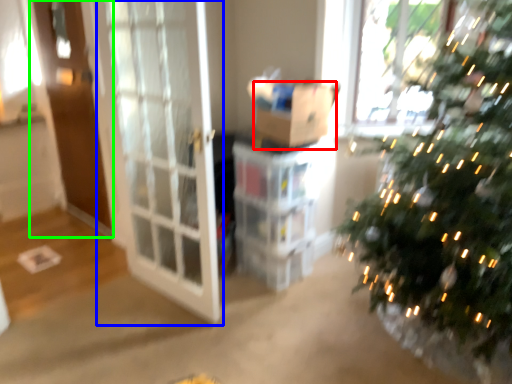
Question: Which object is positioned farthest from cardboard box (highlighted by a red box)? Select from screen door (highlighted by a blue box) and screen door (highlighted by a green box).

Choices:
 (A) screen door
 (B) screen door

Answer: (B)